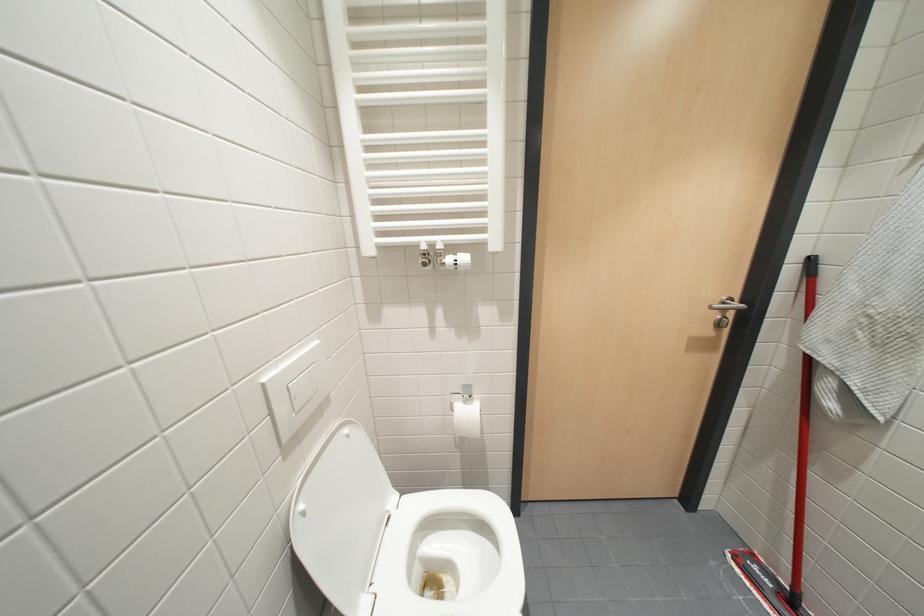
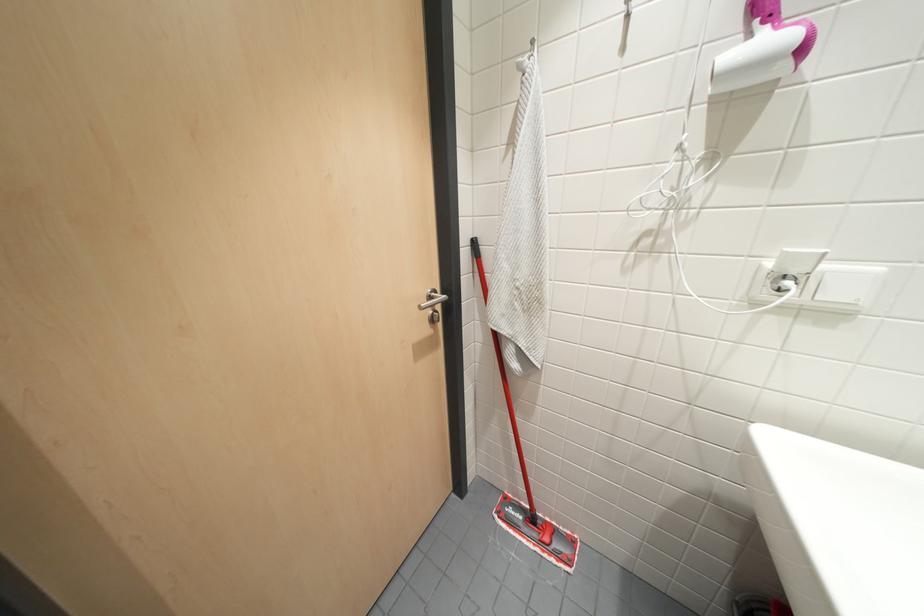
Question: The camera is either moving clockwise (left) or counter-clockwise (right) around the object. The first image is from the beginning of the video and the second image is from the end. Is the camera moving left or right when shooting the video?

Choices:
 (A) Left
 (B) Right

Answer: (A)